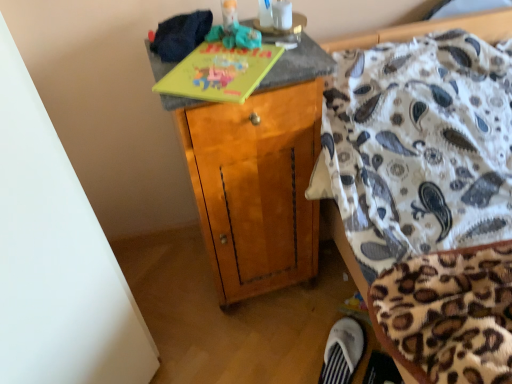
Where is `vacant space behind white fabric slipper at lower right`? This screenshot has width=512, height=384. vacant space behind white fabric slipper at lower right is located at coordinates (315, 313).